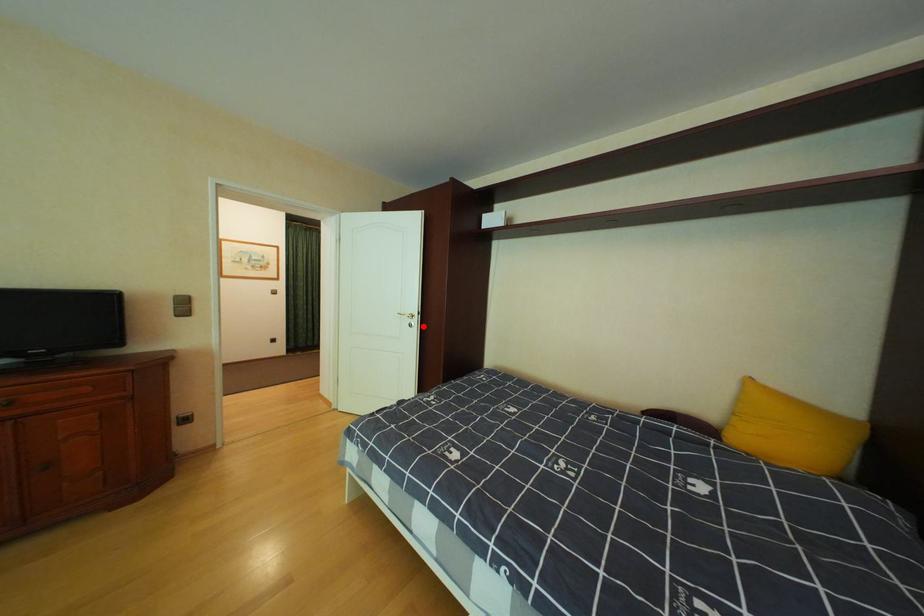
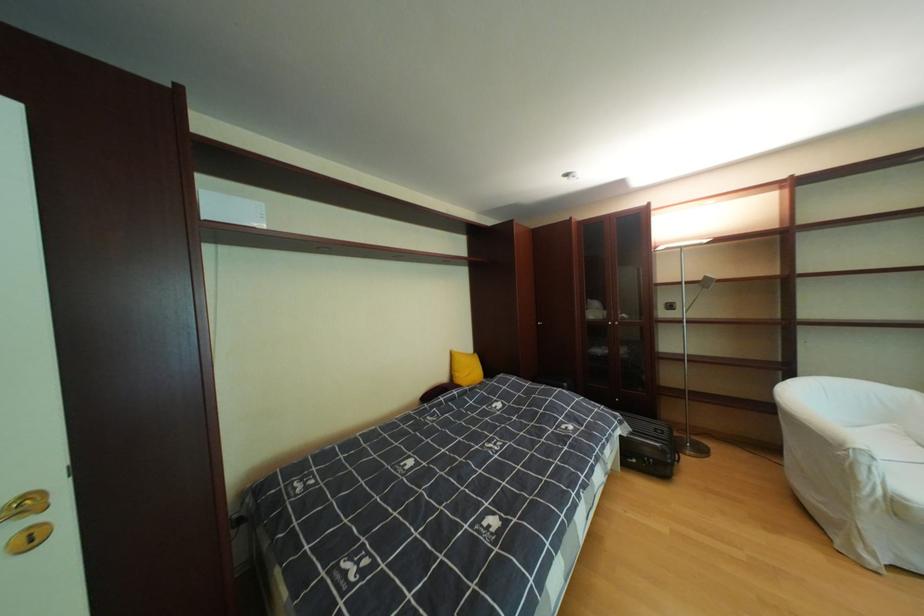
In the second image, find the point that corresponds to the highlighted location in the first image.

(43, 541)